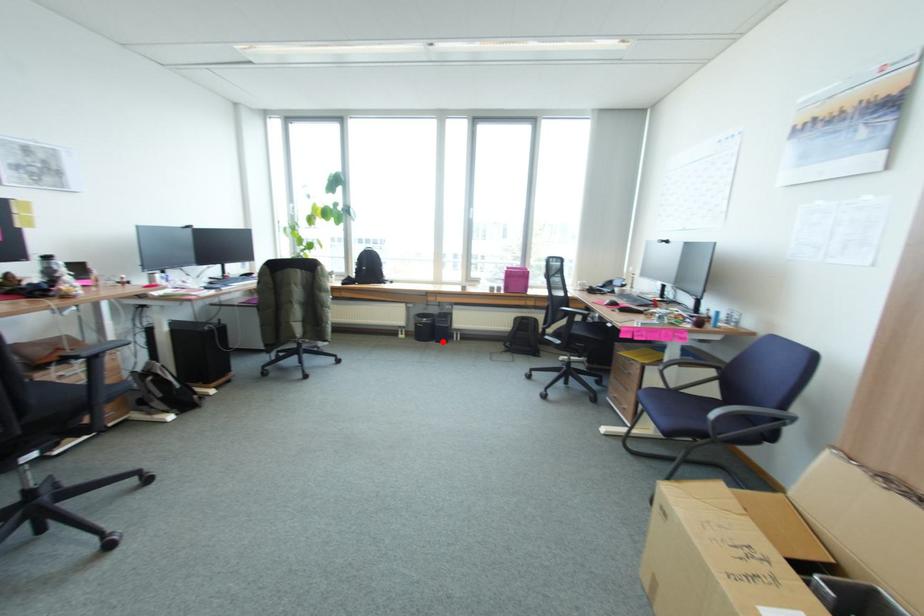
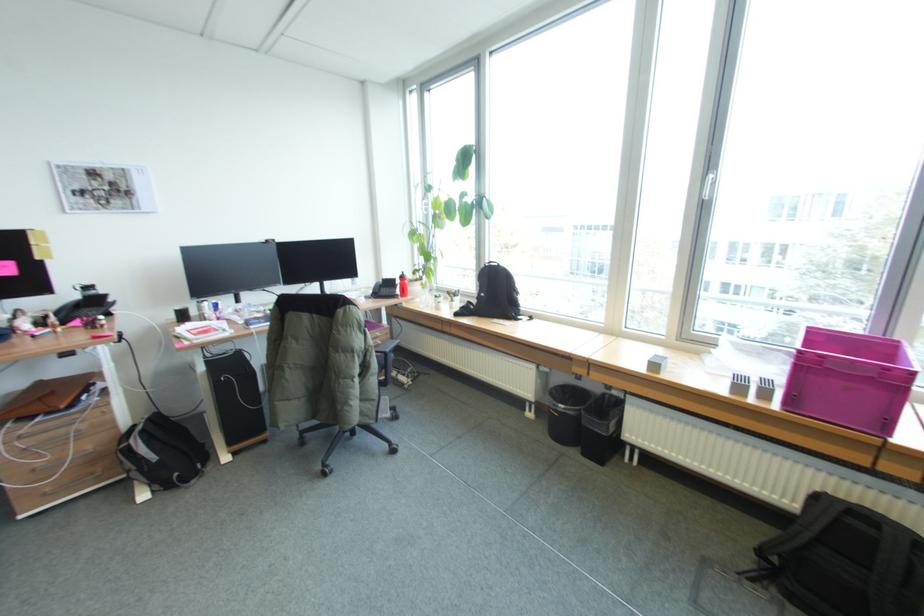
Find the pixel in the second image that matches the highlighted location in the first image.

(590, 455)